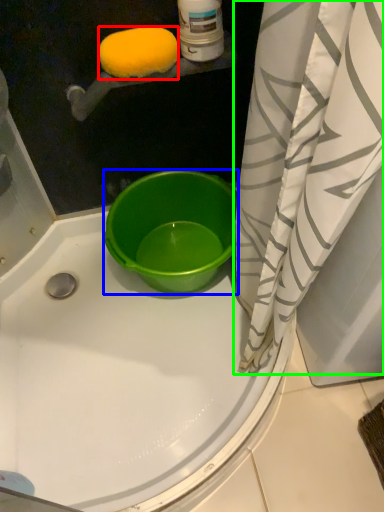
Question: Considering the real-world distances, which object is closest to lemon (highlighted by a red box)? bucket (highlighted by a blue box) or curtain (highlighted by a green box).

Choices:
 (A) bucket
 (B) curtain

Answer: (B)